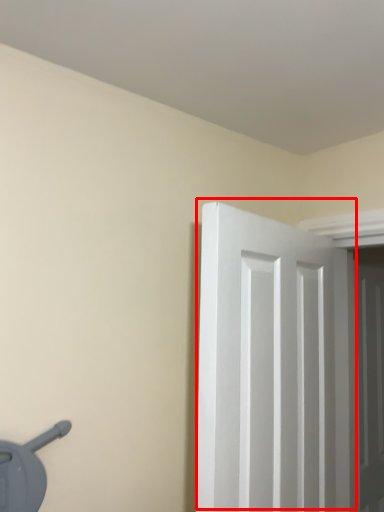
Question: From the image's perspective, considering the relative positions of door (annotated by the red box) and door in the image provided, where is door (annotated by the red box) located with respect to the staircase?

Choices:
 (A) above
 (B) below

Answer: (A)